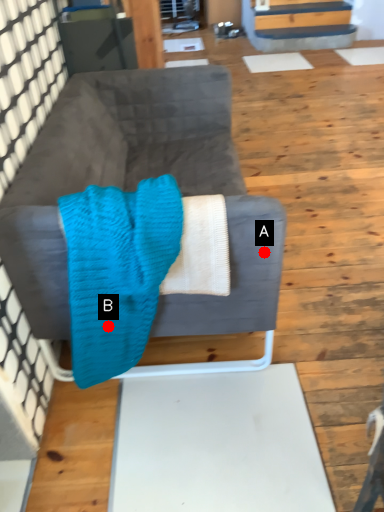
Question: Two points are circled on the image, labeled by A and B beside each circle. Which point appears closest to the camera in this image?

Choices:
 (A) A is closer
 (B) B is closer

Answer: (A)